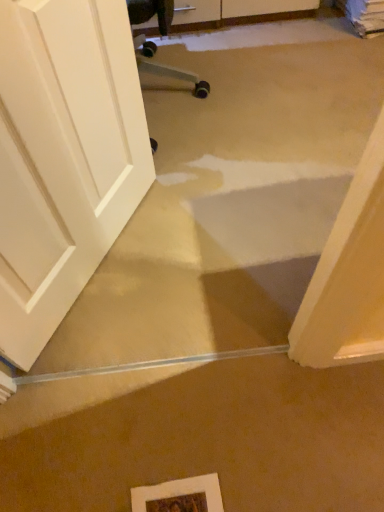
What do you see at coordinates (179, 496) in the screenshot? I see `white matte picture frame at lower center` at bounding box center [179, 496].

The image size is (384, 512). Find the location of `white matte picture frame at lower center`. white matte picture frame at lower center is located at coordinates tap(179, 496).

You are a GUI agent. You are given a task and a screenshot of the screen. Output one action in this format:
    pyautogui.click(x=<x>, y=<y>)
    Task: Click on the white matte door at left
    
    Given the screenshot: What is the action you would take?
    pyautogui.click(x=63, y=157)

Image resolution: width=384 pixels, height=512 pixels. What do you see at coordinates (63, 157) in the screenshot? I see `white matte door at left` at bounding box center [63, 157].

At what (x,y) coordinates should I click in order to perform the action: click on white matte picture frame at lower center. Please return your answer as a coordinate pair (x, y). Looking at the image, I should click on (179, 496).

In the image, is white matte door at left on the left side or the right side of white matte picture frame at lower center?

From the image, it's evident that white matte door at left is to the left of white matte picture frame at lower center.

Is white matte door at left positioned before white matte picture frame at lower center?

That is True.

Which is behind, point (88, 67) or point (159, 484)?

Positioned behind is point (159, 484).

From the image's perspective, relative to white matte picture frame at lower center, is white matte door at left above or below?

Based on their image positions, white matte door at left is located above white matte picture frame at lower center.

From a real-world perspective, which object stands above the other?

white matte door at left.

In the scene shown: Considering the sizes of objects white matte door at left and white matte picture frame at lower center in the image provided, who is wider, white matte door at left or white matte picture frame at lower center?

With larger width is white matte picture frame at lower center.

Is white matte door at left taller or shorter than white matte picture frame at lower center?

Clearly, white matte door at left is taller compared to white matte picture frame at lower center.

Does white matte door at left have a smaller size compared to white matte picture frame at lower center?

Actually, white matte door at left might be larger than white matte picture frame at lower center.

Do you think white matte door at left is within white matte picture frame at lower center, or outside of it?

white matte door at left cannot be found inside white matte picture frame at lower center.

Is white matte door at left placed right next to white matte picture frame at lower center?

white matte door at left and white matte picture frame at lower center are clearly separated.

Is white matte door at left facing away from white matte picture frame at lower center?

No, white matte door at left is not facing away from white matte picture frame at lower center.

What's the angular difference between white matte door at left and white matte picture frame at lower center's facing directions?

125 degrees.

In the image, there is a white matte door at left. Where is `picture frame below it (from the image's perspective)`? Image resolution: width=384 pixels, height=512 pixels. picture frame below it (from the image's perspective) is located at coordinates (179, 496).

Between white matte picture frame at lower center and white matte door at left, which one appears on the right side from the viewer's perspective?

From the viewer's perspective, white matte picture frame at lower center appears more on the right side.

Is the position of white matte picture frame at lower center more distant than that of white matte door at left?

Yes, white matte picture frame at lower center is behind white matte door at left.

Does point (180, 499) lie in front of point (44, 314)?

Yes, it is in front of point (44, 314).

From the image's perspective, does white matte picture frame at lower center appear lower than white matte door at left?

Yes.

From a real-world perspective, which object rests below the other?

white matte picture frame at lower center, from a real-world perspective.

Between white matte picture frame at lower center and white matte door at left, which one has larger width?

white matte picture frame at lower center is wider.

From their relative heights in the image, would you say white matte picture frame at lower center is taller or shorter than white matte door at left?

Considering their sizes, white matte picture frame at lower center has less height than white matte door at left.

In terms of size, does white matte picture frame at lower center appear bigger or smaller than white matte door at left?

Clearly, white matte picture frame at lower center is smaller in size than white matte door at left.

Which is correct: white matte picture frame at lower center is inside white matte door at left, or outside of it?

white matte picture frame at lower center is spatially situated outside white matte door at left.

Are white matte picture frame at lower center and white matte door at left making contact?

No, white matte picture frame at lower center is not beside white matte door at left.

Is white matte picture frame at lower center positioned with its back to white matte door at left?

white matte picture frame at lower center does not have its back to white matte door at left.

What's the angular difference between white matte picture frame at lower center and white matte door at left's facing directions?

white matte picture frame at lower center and white matte door at left are facing 125 degrees away from each other.

The image size is (384, 512). In order to click on picture frame on the right of white matte door at left in this screenshot , I will do `click(179, 496)`.

Where is `picture frame that is on the right side of white matte door at left`? The height and width of the screenshot is (512, 384). picture frame that is on the right side of white matte door at left is located at coordinates (179, 496).

At what (x,y) coordinates should I click in order to perform the action: click on door above the white matte picture frame at lower center (from a real-world perspective). Please return your answer as a coordinate pair (x, y). The width and height of the screenshot is (384, 512). Looking at the image, I should click on (63, 157).